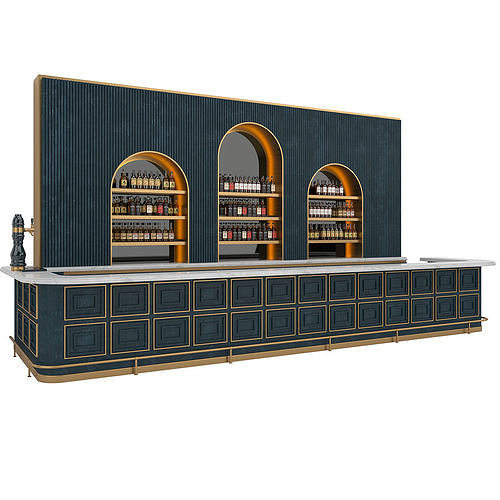
Image resolution: width=500 pixels, height=500 pixels. Identify the location of grey bar counter surface for customers. (460, 261), (300, 273), (47, 274).